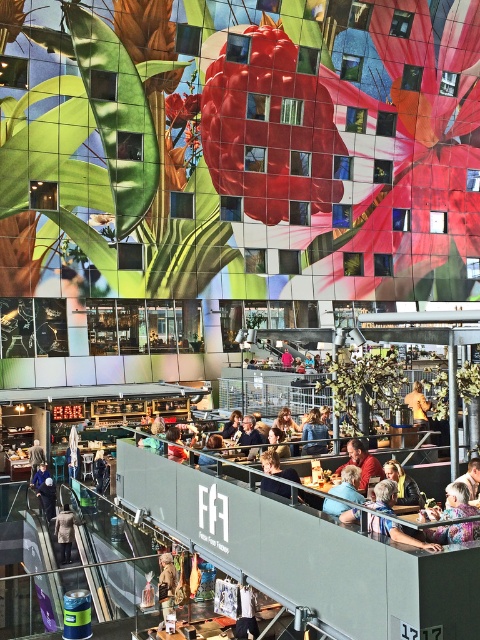
Between light brown leather jacket at upper center and orange fabric shirt at center, which one is positioned higher?

light brown leather jacket at upper center is higher up.

Can you confirm if light brown leather jacket at upper center is taller than orange fabric shirt at center?

No.

Does point (359, 499) lie in front of point (418, 412)?

Yes, it is in front of point (418, 412).

Identify the location of light brown leather jacket at upper center. The height and width of the screenshot is (640, 480). (348, 484).

Which of these two, dark gray wool coat at lower left or orange fabric shirt at center, stands taller?

dark gray wool coat at lower left is taller.

Is dark gray wool coat at lower left positioned in front of orange fabric shirt at center?

No, dark gray wool coat at lower left is behind orange fabric shirt at center.

Which is behind, point (70, 541) or point (416, 419)?

Positioned behind is point (70, 541).

Find the location of a particular element. dark gray wool coat at lower left is located at coordinates (64, 532).

Does shiny red flower at center have a larger size compared to vibrant matte red flower at center?

Yes.

Where is `shiny red flower at center`? Image resolution: width=480 pixels, height=640 pixels. shiny red flower at center is located at coordinates (266, 124).